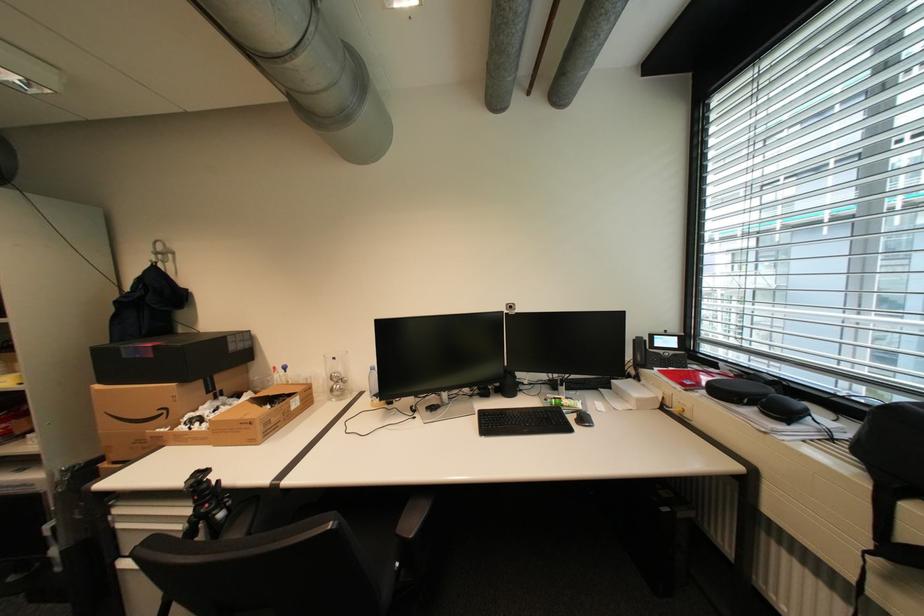
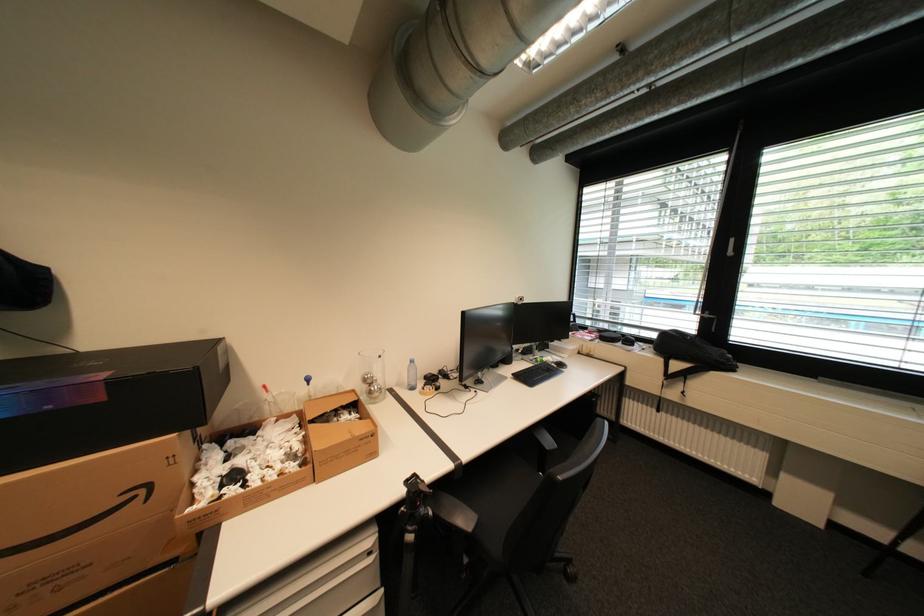
Find the pixel in the second image that matches pixel 343 376 in the first image.

(377, 378)